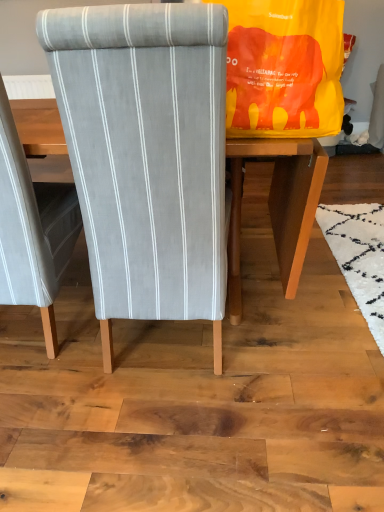
You are a GUI agent. You are given a task and a screenshot of the screen. Output one action in this format:
    pyautogui.click(x=<x>, y=<y>)
    Task: Click on the free space in front of gray fabric chair at center, the 1th chair from the right
    
    Given the screenshot: What is the action you would take?
    pyautogui.click(x=164, y=437)